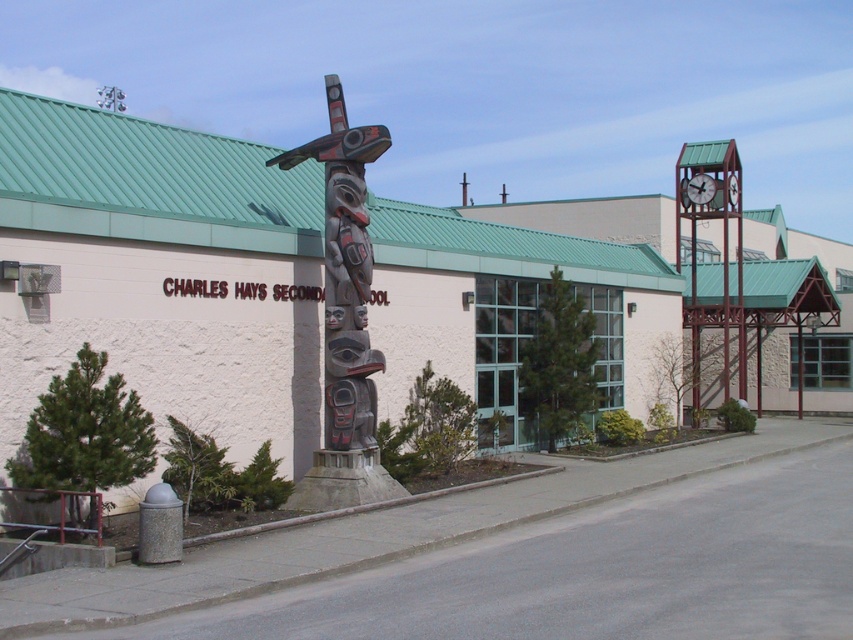
Does carved wooden totem pole at center have a lesser width compared to green metal clock tower at right?

Correct, carved wooden totem pole at center's width is less than green metal clock tower at right's.

Is point (331, 236) positioned in front of point (727, 321)?

Yes, point (331, 236) is in front of point (727, 321).

Where is `carved wooden totem pole at center`? carved wooden totem pole at center is located at coordinates (345, 273).

I want to click on green metal clock tower at right, so click(x=721, y=257).

Describe the element at coordinates (721, 257) in the screenshot. I see `green metal clock tower at right` at that location.

At what (x,y) coordinates should I click in order to perform the action: click on green metal clock tower at right. Please return your answer as a coordinate pair (x, y). The height and width of the screenshot is (640, 853). Looking at the image, I should click on (721, 257).

Is point (334, 125) positioned in front of point (698, 193)?

Yes, it is in front of point (698, 193).

What do you see at coordinates (345, 273) in the screenshot?
I see `carved wooden totem pole at center` at bounding box center [345, 273].

Locate an element on the screen. The height and width of the screenshot is (640, 853). carved wooden totem pole at center is located at coordinates (345, 273).